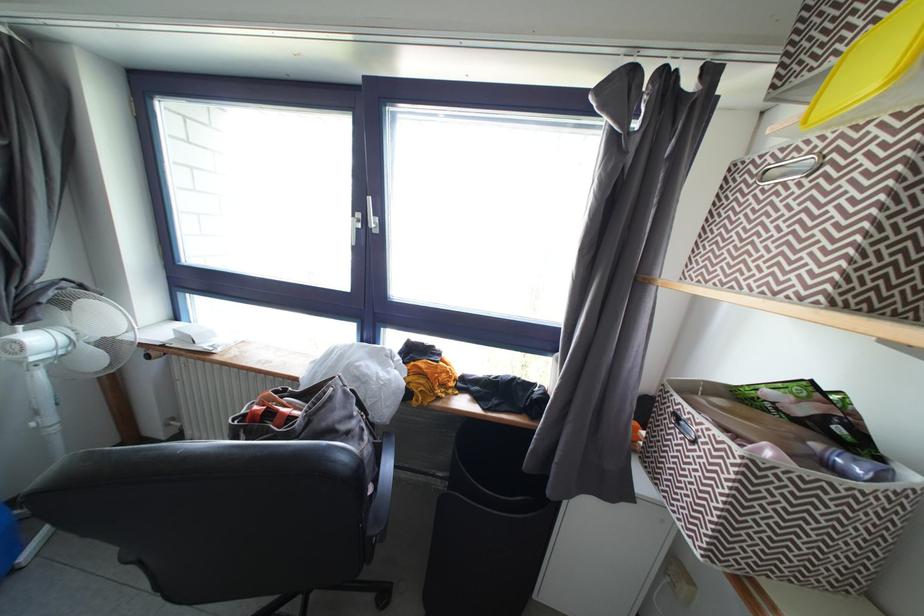
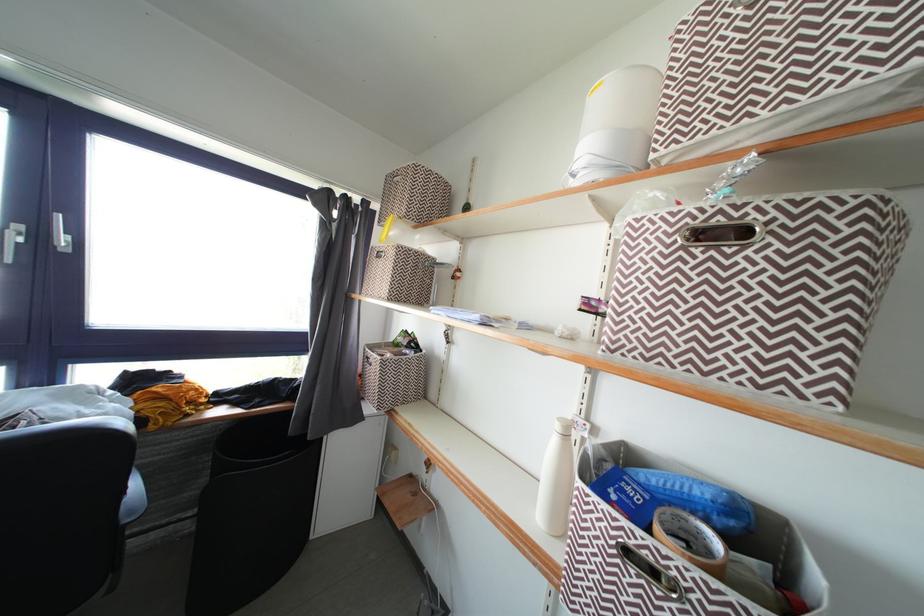
The point at (554,496) is marked in the first image. Where is the corresponding point in the second image?

(315, 442)